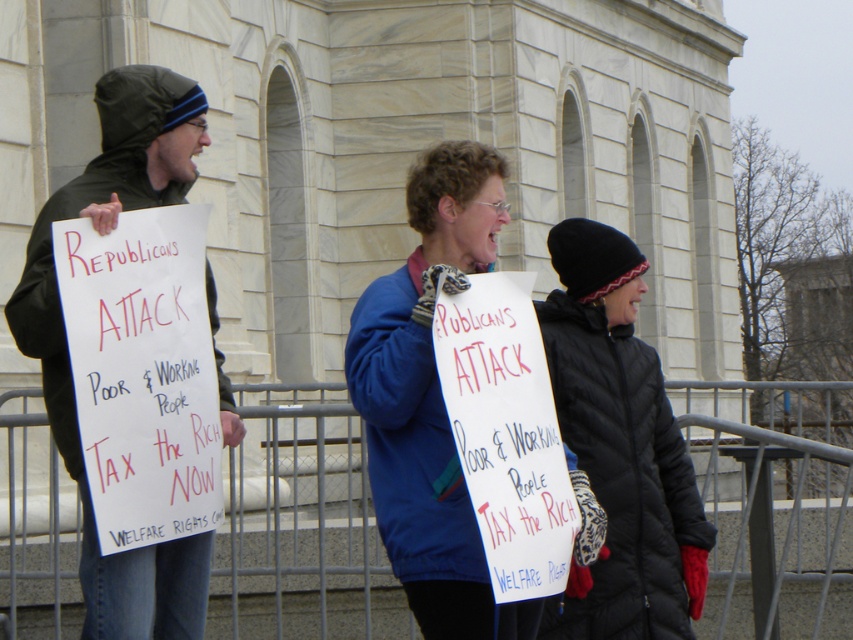
Question: Which of the following is the closest to the observer?

Choices:
 (A) (509, 308)
 (B) (140, 400)
 (C) (265, 504)
 (D) (442, 445)

Answer: (A)

Question: Can you confirm if white paper sign at left is positioned above blue fabric jacket at center?

Choices:
 (A) yes
 (B) no

Answer: (A)

Question: Which point appears farthest from the camera in this image?

Choices:
 (A) (561, 582)
 (B) (426, 483)

Answer: (B)

Question: Can you confirm if metal fence at center is smaller than white paper sign at left?

Choices:
 (A) yes
 (B) no

Answer: (B)

Question: Which object is the closest to the blue fabric jacket at center?

Choices:
 (A) white paper sign at center
 (B) black quilted jacket at center
 (C) metal fence at center

Answer: (A)

Question: Can you confirm if metal fence at center is bigger than white paper sign at left?

Choices:
 (A) no
 (B) yes

Answer: (B)